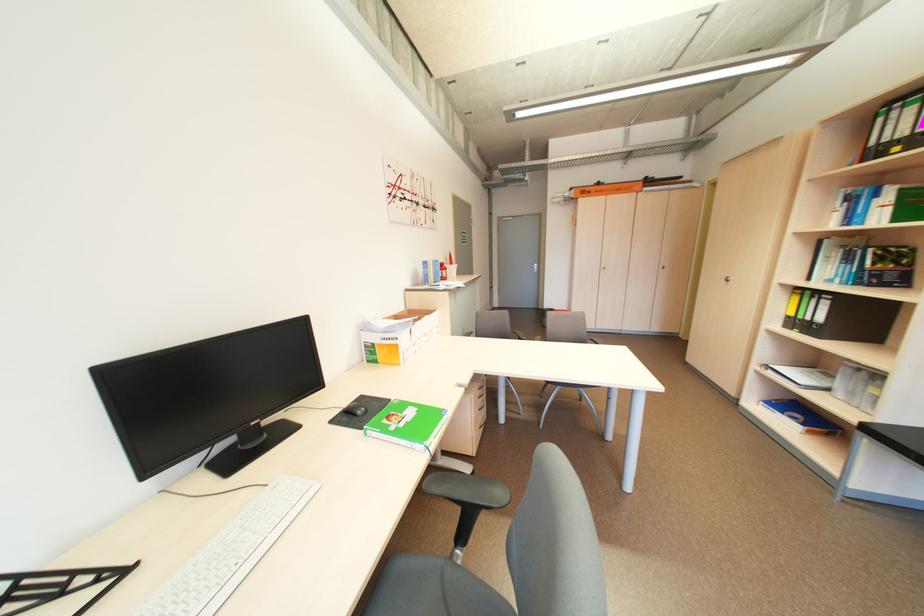
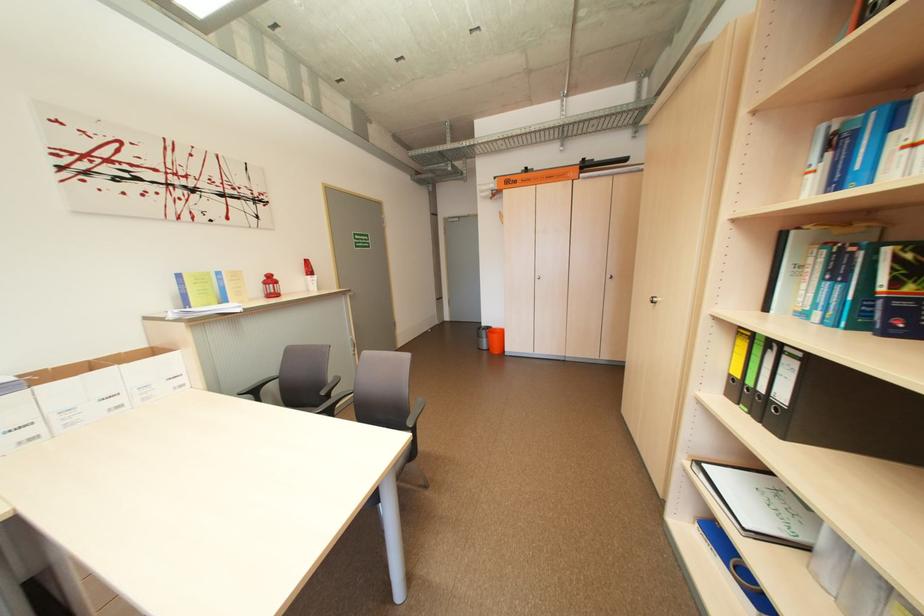
Find the pixel in the second image that matches pixel 424 322 in the first image.

(43, 384)